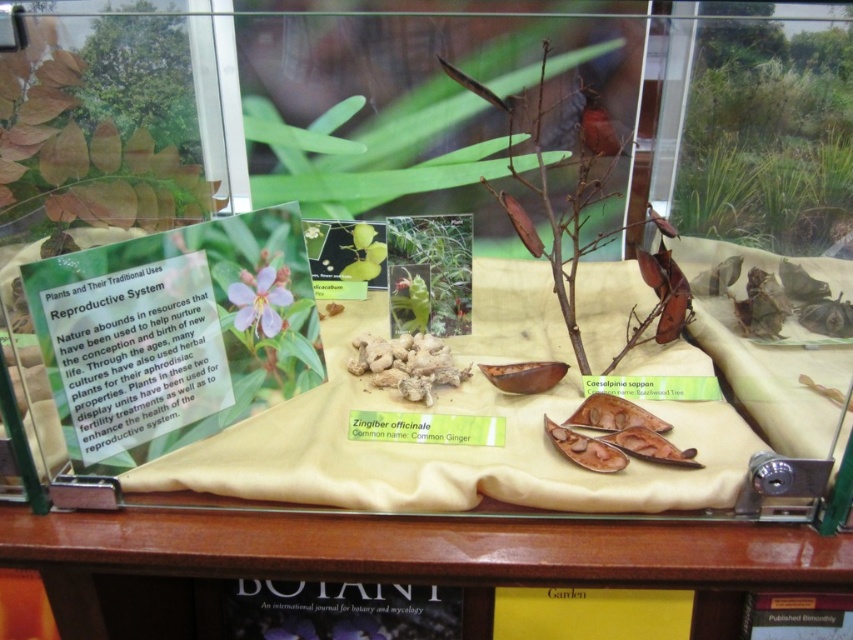
Consider the image. Which of these two, beige fabric at center or purple matte flower at upper center, stands shorter?

purple matte flower at upper center is shorter.

From the picture: Between beige fabric at center and purple matte flower at upper center, which one appears on the right side from the viewer's perspective?

Positioned to the right is beige fabric at center.

What do you see at coordinates (462, 424) in the screenshot? This screenshot has height=640, width=853. I see `beige fabric at center` at bounding box center [462, 424].

The height and width of the screenshot is (640, 853). I want to click on beige fabric at center, so click(x=462, y=424).